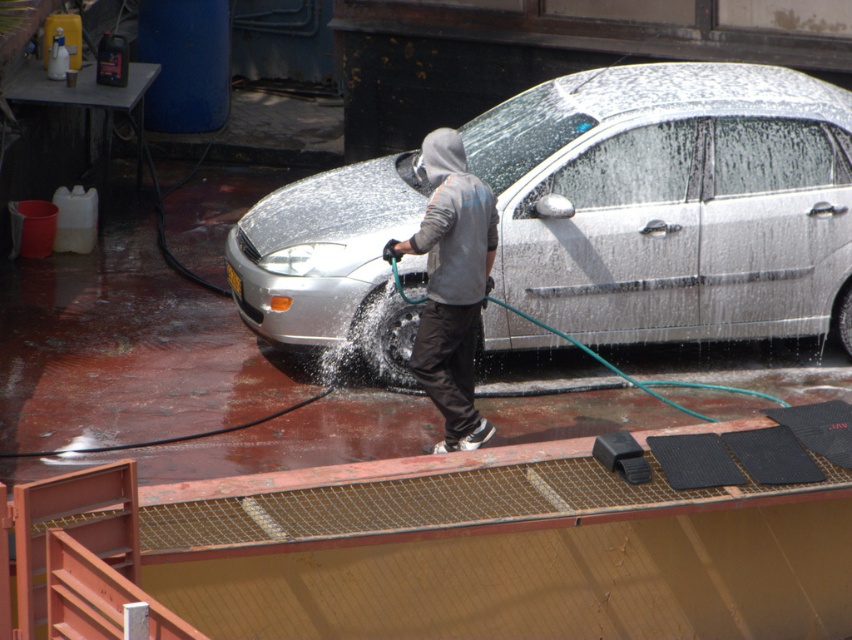
You are standing at the car wash and want to reach both the point at coordinates point (804, 113) and the point at coordinates point (455, 342). Which point will you reach first?

You will reach point (804, 113) first because it is closer to you than point (455, 342), which is further away.

You are standing in the car wash area and want to reach the silver metallic car at center to retrieve a dropped item. Is the gray hoodie at center blocking your direct path to the car?

The silver metallic car at center is above the gray hoodie at center, so the gray hoodie at center is not blocking the direct path to the car.

You are a pedestrian walking towards the silver metallic car at center and the gray hoodie at center. Which object will you encounter first?

You will encounter the gray hoodie at center first because it is behind the silver metallic car at center, so the car is closer to you.